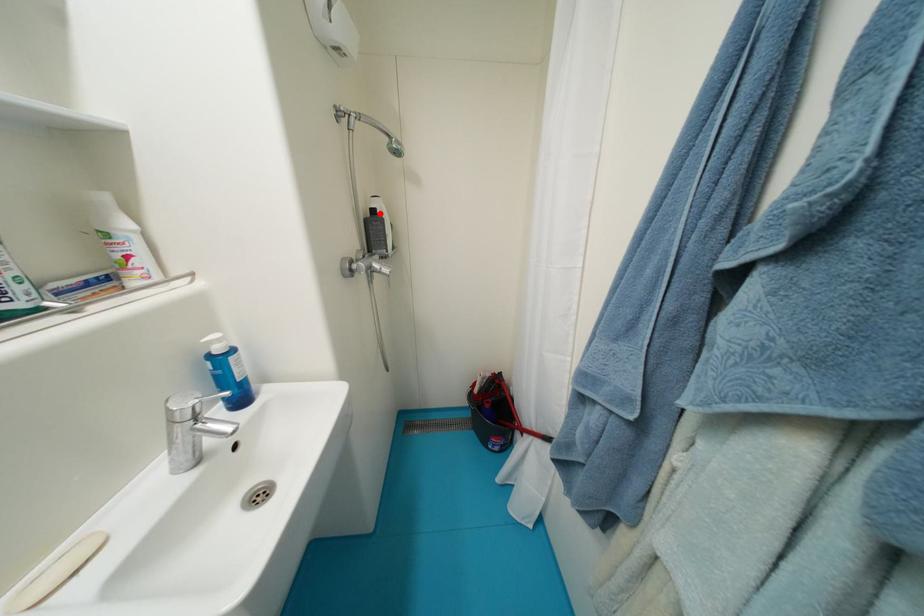
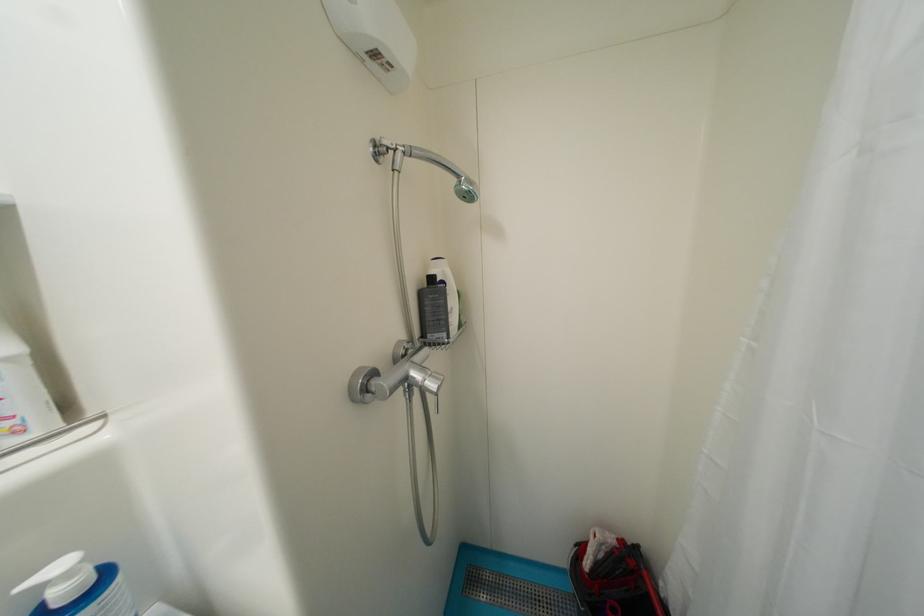
Where in the second image is the point corresponding to the highlighted location from the first image?

(439, 281)